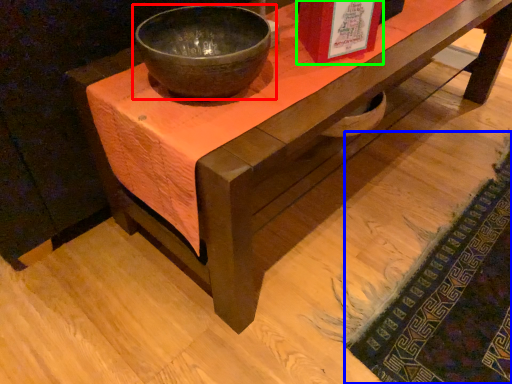
Question: Considering the real-world distances, which object is closest to bowl (highlighted by a red box)? mat (highlighted by a blue box) or book cover (highlighted by a green box).

Choices:
 (A) mat
 (B) book cover

Answer: (B)